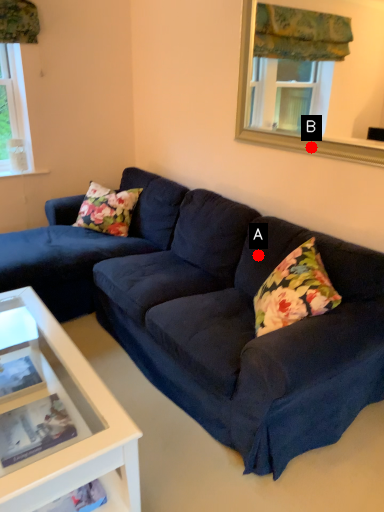
Question: Two points are circled on the image, labeled by A and B beside each circle. Which point is closer to the camera?

Choices:
 (A) A is closer
 (B) B is closer

Answer: (A)